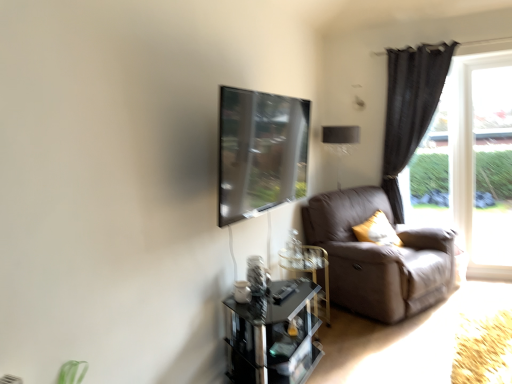
This screenshot has width=512, height=384. Identify the location of vacant space in front of leather at right. (397, 334).